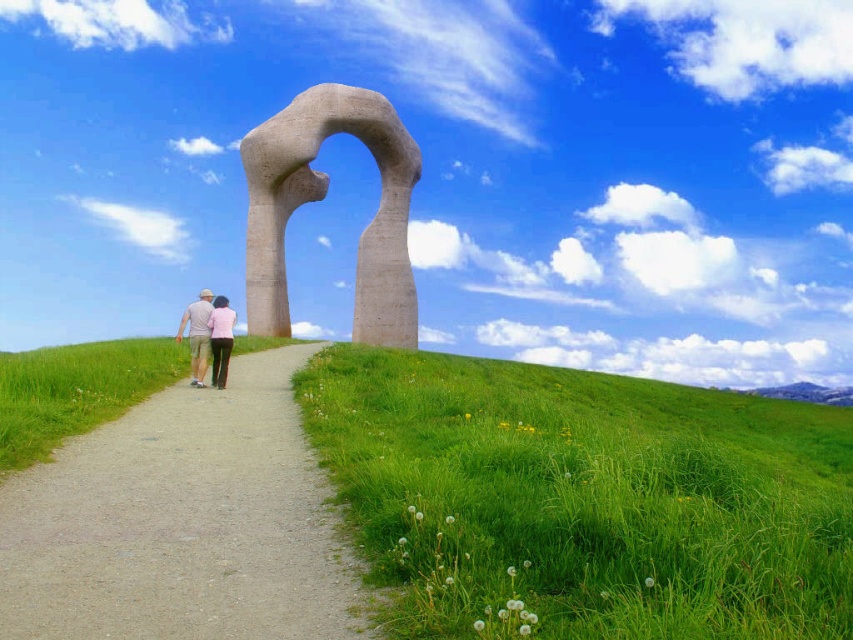
You are standing on the gravel path at center and want to reach the light brown fabric pants at center. In which direction should you move?

The gravel path at center is to the right of light brown fabric pants at center, so to reach them, you should move to the left.

You are planning to place a picnic blanket on the green grass at lower right and the pink fabric at center. Which area can accommodate a larger blanket?

The green grass at lower right is larger in size than the pink fabric at center, so it can accommodate a larger blanket.